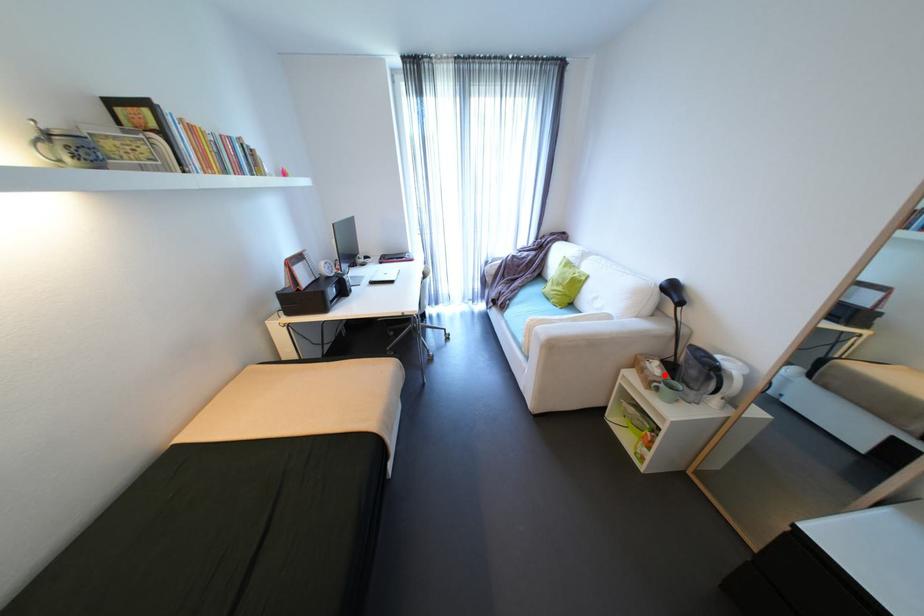
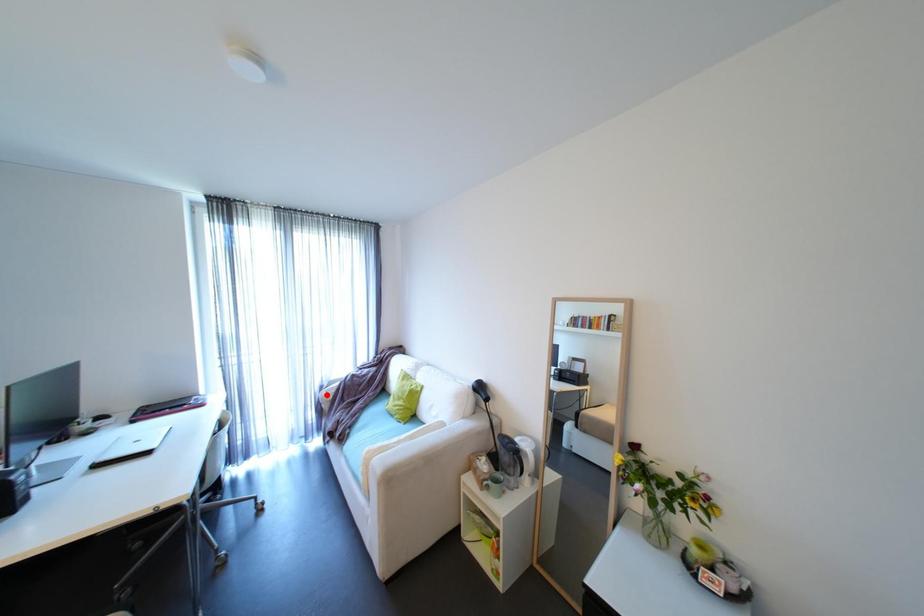
I am providing you with two images of the same scene from different viewpoints. A red point is marked on the first image and another point is marked on the second image. Is the marked point in image1 the same physical position as the marked point in image2?

No